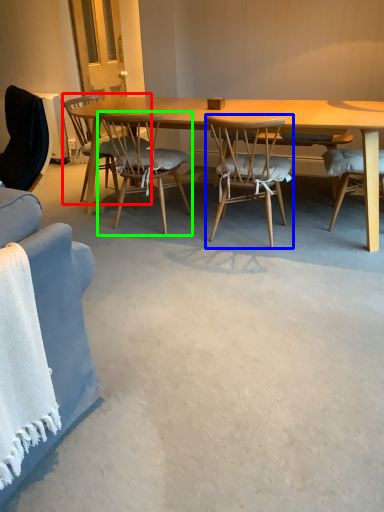
Question: Considering the real-world distances, which object is closest to chair (highlighted by a red box)? chair (highlighted by a blue box) or chair (highlighted by a green box).

Choices:
 (A) chair
 (B) chair

Answer: (B)